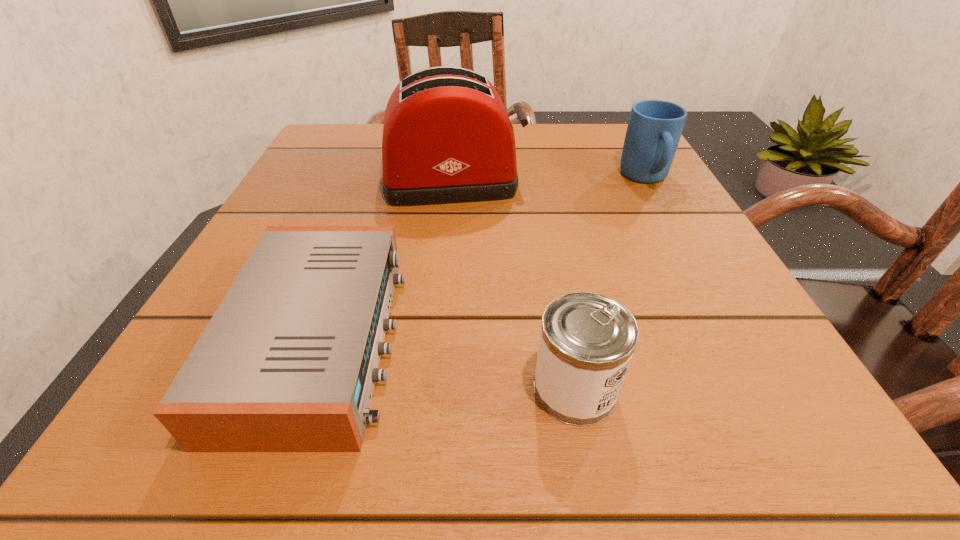
The width and height of the screenshot is (960, 540). I want to click on toaster, so click(447, 138).

Identify the location of mug. The height and width of the screenshot is (540, 960). (654, 129).

At what (x,y) coordinates should I click in order to perform the action: click on can. Please return your answer as a coordinate pair (x, y). Looking at the image, I should click on pyautogui.click(x=587, y=340).

Where is `the shortest object`? The height and width of the screenshot is (540, 960). the shortest object is located at coordinates (288, 362).

Locate an element on the screen. This screenshot has width=960, height=540. vacant space located 0.100m on the back of the toaster is located at coordinates tap(457, 138).

This screenshot has width=960, height=540. I want to click on vacant space located 0.160m on the side of the mug with the handle, so click(684, 251).

The height and width of the screenshot is (540, 960). Identify the location of free location located on the left of the third tallest object. (397, 389).

The height and width of the screenshot is (540, 960). What are the coordinates of `vacant space situated 0.080m on the front panel of the shortest object` in the screenshot? It's located at (458, 341).

Find the location of a particular element. The image size is (960, 540). toaster situated at the far edge is located at coordinates (447, 138).

The width and height of the screenshot is (960, 540). In order to click on mug that is positioned at the far edge in this screenshot , I will do `click(654, 129)`.